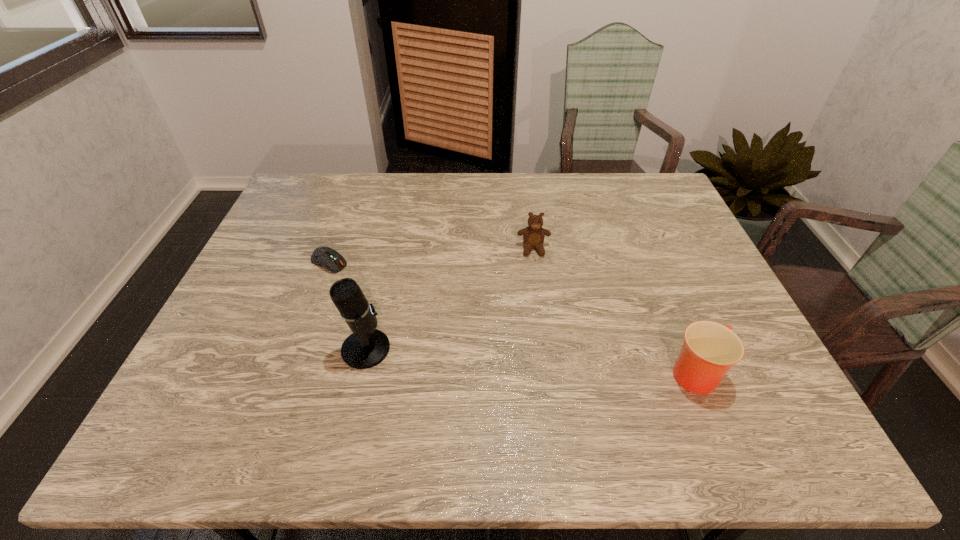
Find the location of a particular element. vacant space located on the button of the leftmost object is located at coordinates (382, 295).

I want to click on free space located 0.320m at the face of the second object from right to left, so click(542, 348).

At what (x,y) coordinates should I click in order to perform the action: click on free space located 0.210m at the face of the second object from right to left. Please return your answer as a coordinate pair (x, y). Looking at the image, I should click on (540, 313).

Where is `free spot located 0.180m at the face of the second object from right to left`? The width and height of the screenshot is (960, 540). free spot located 0.180m at the face of the second object from right to left is located at coordinates (539, 304).

Locate an element on the screen. The width and height of the screenshot is (960, 540). microphone situated at the near edge is located at coordinates (366, 347).

At what (x,y) coordinates should I click in order to perform the action: click on cup positioned at the near edge. Please return your answer as a coordinate pair (x, y). The height and width of the screenshot is (540, 960). Looking at the image, I should click on (710, 349).

At what (x,y) coordinates should I click in order to perform the action: click on object situated at the left edge. Please return your answer as a coordinate pair (x, y). Looking at the image, I should click on (326, 257).

The height and width of the screenshot is (540, 960). I want to click on object that is positioned at the right edge, so click(710, 349).

Locate an element on the screen. The width and height of the screenshot is (960, 540). object situated at the near right corner is located at coordinates (710, 349).

In the image, there is a desktop. Where is `vacant region at the far edge`? Image resolution: width=960 pixels, height=540 pixels. vacant region at the far edge is located at coordinates (420, 204).